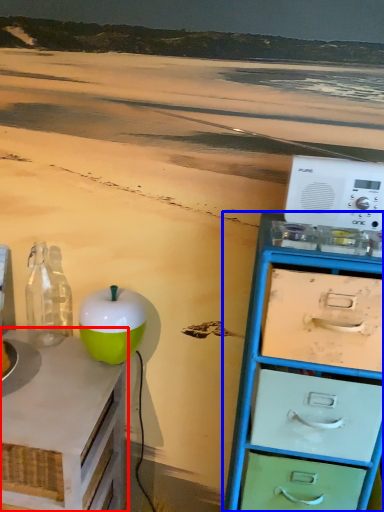
Question: Which object is further to the camera taking this photo, table (highlighted by a red box) or chest of drawers (highlighted by a blue box)?

Choices:
 (A) table
 (B) chest of drawers

Answer: (A)